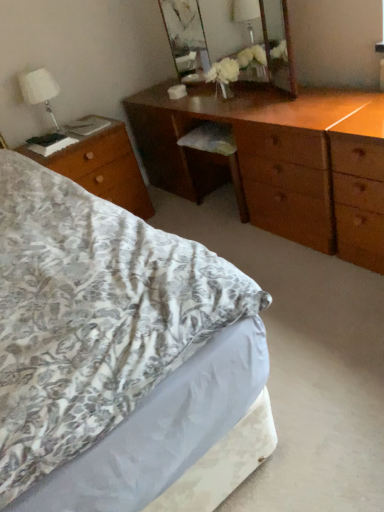
Question: Can you confirm if shiny brown dresser at center is wider than wooden desk at left?

Choices:
 (A) no
 (B) yes

Answer: (A)

Question: Is shiny brown dresser at center shorter than wooden desk at left?

Choices:
 (A) yes
 (B) no

Answer: (B)

Question: Is wooden desk at left located within shiny brown dresser at center?

Choices:
 (A) yes
 (B) no

Answer: (B)

Question: Would you say shiny brown dresser at center is a long distance from wooden desk at left?

Choices:
 (A) yes
 (B) no

Answer: (B)

Question: Does shiny brown dresser at center appear on the left side of wooden desk at left?

Choices:
 (A) no
 (B) yes

Answer: (A)

Question: Does shiny brown dresser at center appear on the right side of wooden desk at left?

Choices:
 (A) no
 (B) yes

Answer: (B)

Question: Is floral fabric bed at lower left with shiny brown dresser at center?

Choices:
 (A) yes
 (B) no

Answer: (B)

Question: Is floral fabric bed at lower left not within shiny brown dresser at center?

Choices:
 (A) no
 (B) yes

Answer: (B)

Question: Considering the relative positions of floral fabric bed at lower left and shiny brown dresser at center in the image provided, is floral fabric bed at lower left to the right of shiny brown dresser at center from the viewer's perspective?

Choices:
 (A) yes
 (B) no

Answer: (B)

Question: Is shiny brown dresser at center at the back of floral fabric bed at lower left?

Choices:
 (A) no
 (B) yes

Answer: (A)

Question: Considering the relative sizes of floral fabric bed at lower left and shiny brown dresser at center in the image provided, is floral fabric bed at lower left wider than shiny brown dresser at center?

Choices:
 (A) no
 (B) yes

Answer: (B)

Question: From a real-world perspective, is floral fabric bed at lower left physically above shiny brown dresser at center?

Choices:
 (A) yes
 (B) no

Answer: (B)

Question: Could wooden desk at left be considered to be inside wooden mirror at upper center?

Choices:
 (A) no
 (B) yes

Answer: (A)